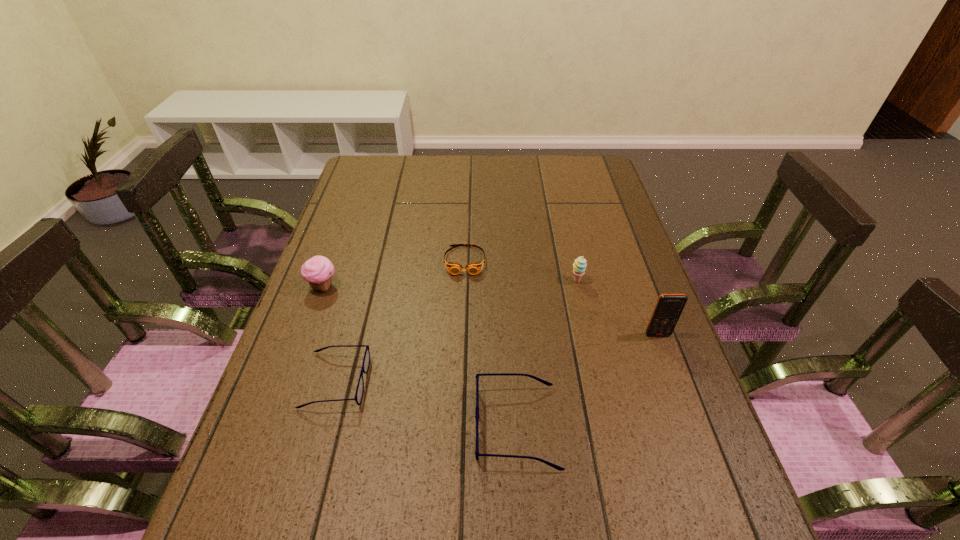
Locate an element on the screen. the shorter spectacles is located at coordinates (366, 360).

Image resolution: width=960 pixels, height=540 pixels. I want to click on the right spectacles, so click(477, 454).

Where is `the fourth tallest object`? This screenshot has width=960, height=540. the fourth tallest object is located at coordinates (477, 454).

Locate an element on the screen. The image size is (960, 540). the fifth object from left to right is located at coordinates (579, 266).

You are a GUI agent. You are given a task and a screenshot of the screen. Output one action in this format:
    pyautogui.click(x=<x>, y=<y>)
    Task: Click on the cupcake
    This screenshot has height=540, width=960.
    Given the screenshot: What is the action you would take?
    pyautogui.click(x=318, y=271)

Image resolution: width=960 pixels, height=540 pixels. I want to click on the rightmost object, so click(x=668, y=308).

You are a GUI agent. You are given a task and a screenshot of the screen. Output one action in this format:
    pyautogui.click(x=<x>, y=<y>)
    Task: Click on the cellular telephone
    
    Given the screenshot: What is the action you would take?
    pyautogui.click(x=668, y=308)

Identify the location of goggles. (454, 268).

Locate an element on the screen. Image resolution: width=960 pixels, height=540 pixels. vacant region located 0.290m on the front-facing side of the left spectacles is located at coordinates (497, 381).

Locate an element on the screen. The image size is (960, 540). free space located 0.120m on the front-facing side of the right spectacles is located at coordinates (417, 426).